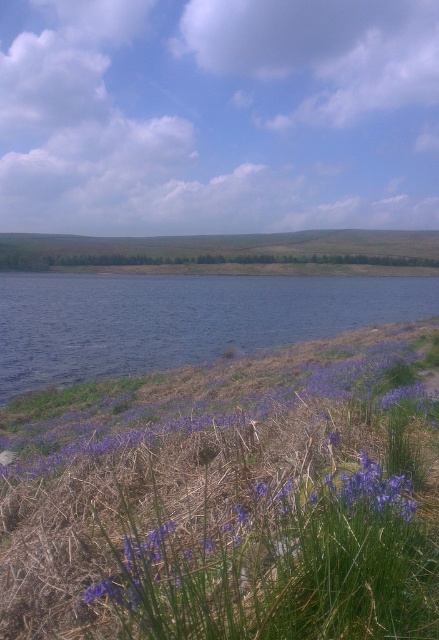
You are standing at the point labeled as point (179, 320) in the image. Looking around, you notice blue liquid water at lower left. Which direction should you face to see the blue liquid water at lower left?

A: You should face the lower left direction to see the blue liquid water at lower left, as it is located at point (179, 320), which is in the lower left area of the image.

You are a gardener planning to plant more purple flowers in the landscape. Given the space available, which of the two plants, the purple grass at lower center or the purple matte flower at lower left, would require more horizontal space to grow properly?

The purple matte flower at lower left requires more horizontal space because it has a greater width than the purple grass at lower center.